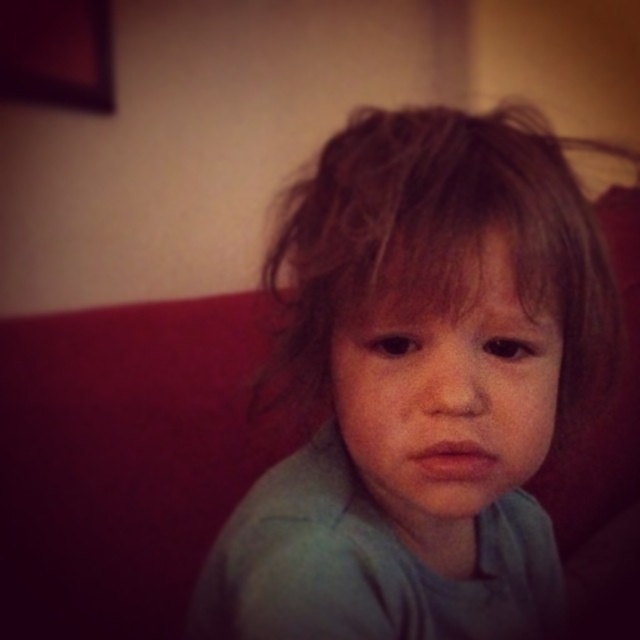
Who is taller, light blue fabric at center or smooth skin face at center?

light blue fabric at center is taller.

Is light blue fabric at center wider than smooth skin face at center?

Correct, the width of light blue fabric at center exceeds that of smooth skin face at center.

Is point (474, 340) more distant than point (378, 296)?

Yes, it is behind point (378, 296).

Find the location of a particular element. light blue fabric at center is located at coordinates (422, 385).